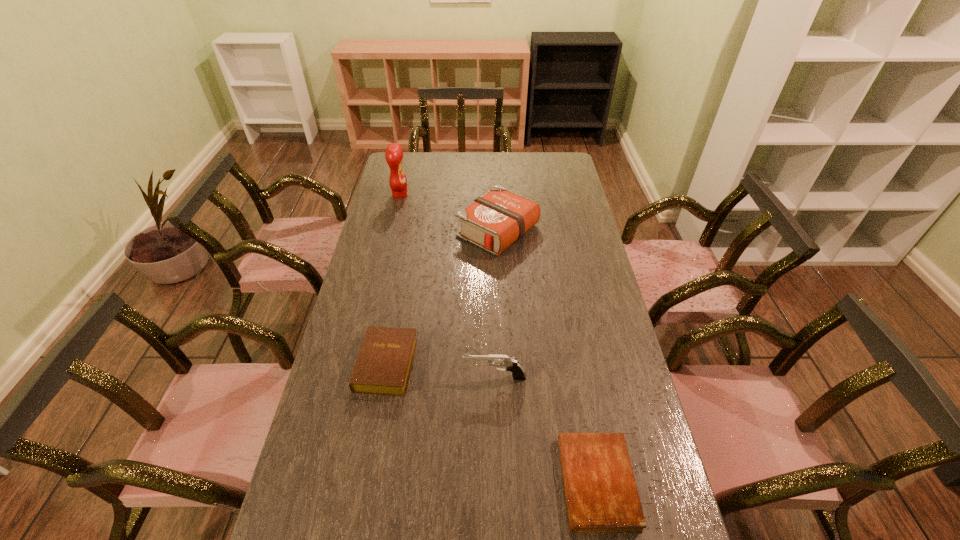
This screenshot has height=540, width=960. I want to click on blank area located 0.060m on the front of the second farthest object, so click(x=499, y=270).

The width and height of the screenshot is (960, 540). Find the location of `vacant space positioned at the muzzle of the gun`. vacant space positioned at the muzzle of the gun is located at coordinates (340, 377).

This screenshot has width=960, height=540. Find the location of `free space located 0.400m at the muzzle of the gun`. free space located 0.400m at the muzzle of the gun is located at coordinates (329, 377).

The width and height of the screenshot is (960, 540). What are the coordinates of `free region located 0.180m at the muzzle of the gun` in the screenshot? It's located at (403, 377).

Identify the location of vacant space located on the back of the second shortest Bible. (403, 272).

Where is `free space located 0.400m on the spine side of the shortest Bible`? This screenshot has width=960, height=540. free space located 0.400m on the spine side of the shortest Bible is located at coordinates (401, 483).

I want to click on blank space located on the spine side of the shortest Bible, so tap(470, 483).

The width and height of the screenshot is (960, 540). Identify the location of vacant area situated 0.220m on the spine side of the shortest Bible. (474, 483).

Locate an element on the screen. This screenshot has height=540, width=960. condiment at the left edge is located at coordinates (394, 154).

Locate an element on the screen. This screenshot has height=540, width=960. Bible that is at the left edge is located at coordinates (383, 366).